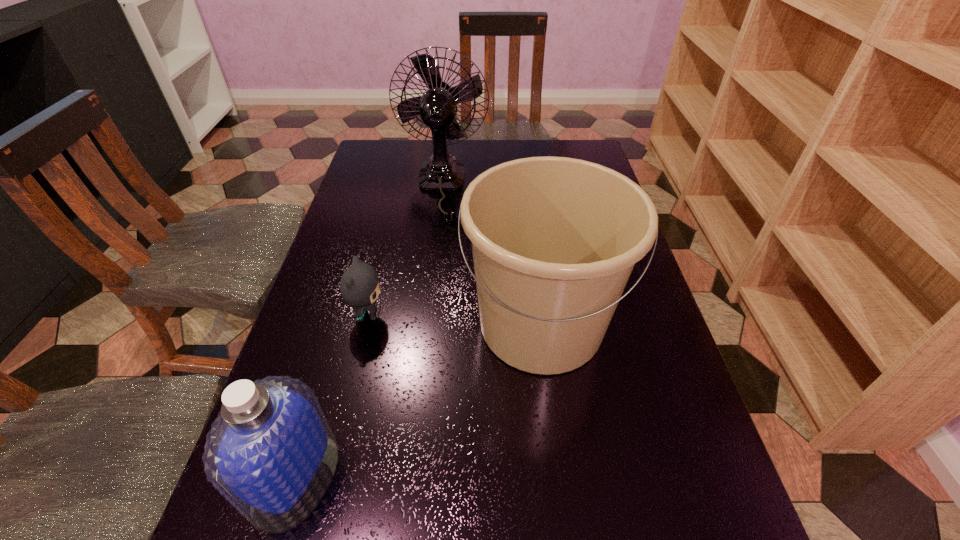
At what (x,y) coordinates should I click in order to perform the action: click on blank region between the shortest object and the fan. Please return your answer as a coordinate pair (x, y). Looking at the image, I should click on (404, 251).

The image size is (960, 540). I want to click on free space between the farthest object and the cleansing agent, so click(369, 333).

Identify the location of vacant point located between the farthest object and the kitten. (404, 251).

This screenshot has width=960, height=540. I want to click on free space that is in between the bucket and the second shortest object, so click(x=418, y=402).

The width and height of the screenshot is (960, 540). In order to click on free space that is in between the shortest object and the bucket in this screenshot , I will do `click(454, 320)`.

Find the location of a particular element. The height and width of the screenshot is (540, 960). empty space that is in between the cleansing agent and the bucket is located at coordinates (418, 402).

I want to click on vacant area between the farthest object and the third tallest object, so click(369, 333).

This screenshot has height=540, width=960. What are the coordinates of `vacant region between the nearest object and the kitten` in the screenshot? It's located at (332, 397).

Identify which object is the nearest to the bucket. Please provide its 2D coordinates. Your answer should be formatted as a tuple, i.e. [(x, y)], where the tuple contains the x and y coordinates of a point satisfying the conditions above.

[(359, 285)]

Identify which object is located as the second nearest to the cleansing agent. Please provide its 2D coordinates. Your answer should be formatted as a tuple, i.e. [(x, y)], where the tuple contains the x and y coordinates of a point satisfying the conditions above.

[(554, 239)]